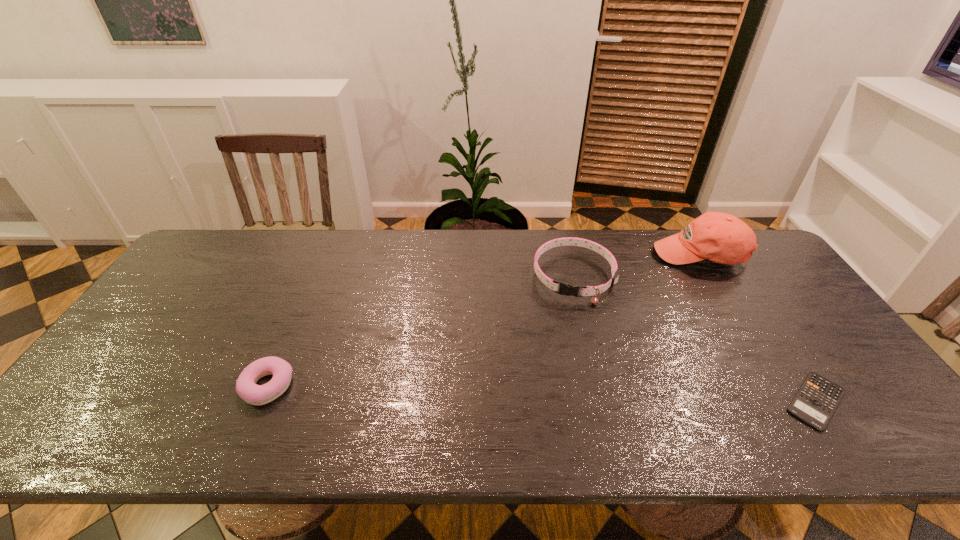
Where is `free point that satisfies the following two spatial constraints: 1. on the front side of the shortest object; 2. on the right side of the dog collar`? free point that satisfies the following two spatial constraints: 1. on the front side of the shortest object; 2. on the right side of the dog collar is located at coordinates (604, 401).

Locate an element on the screen. This screenshot has height=540, width=960. vacant space that satisfies the following two spatial constraints: 1. on the front side of the second tallest object; 2. on the right side of the shortest object is located at coordinates (604, 401).

The image size is (960, 540). In order to click on vacant area that satisfies the following two spatial constraints: 1. on the front side of the third tallest object; 2. on the left side of the calculator in this screenshot , I will do `click(261, 401)`.